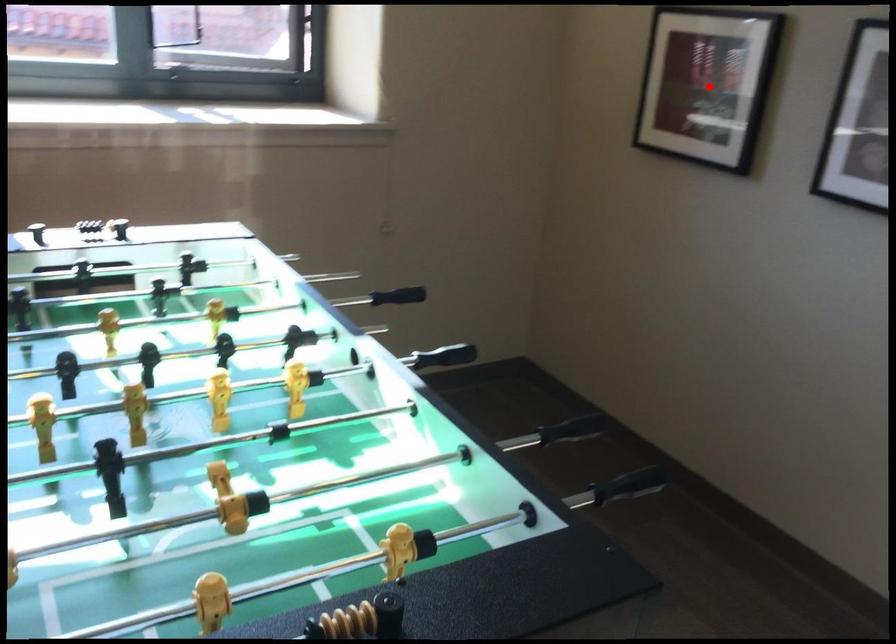
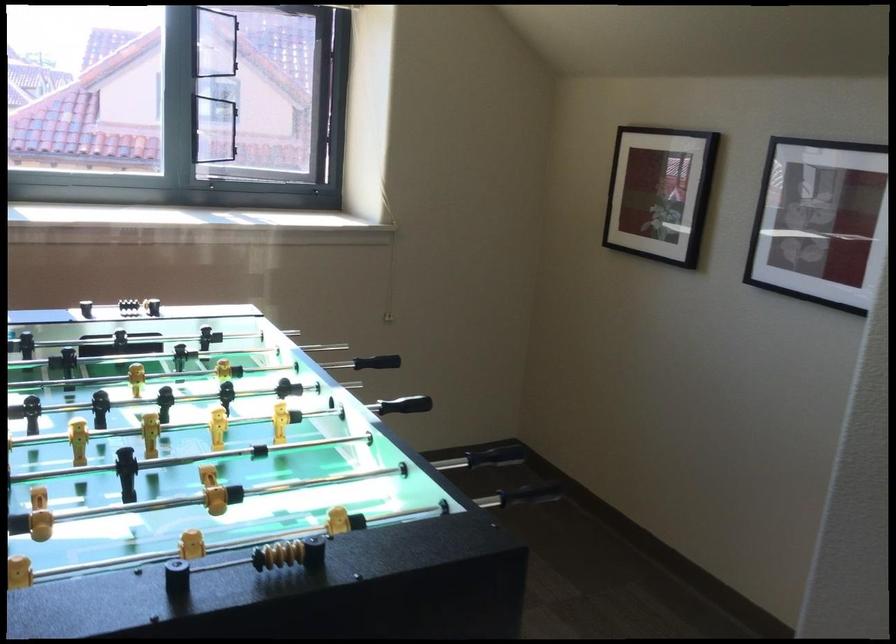
The point at the highlighted location is marked in the first image. Where is the corresponding point in the second image?

(659, 193)